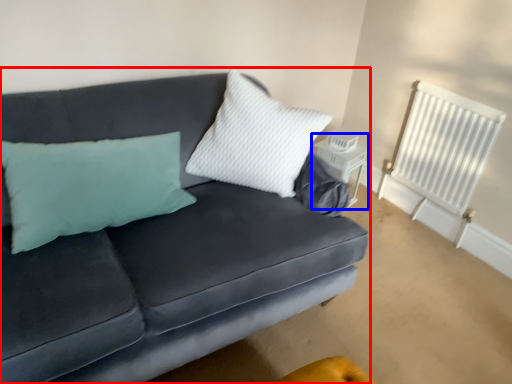
Question: Which object appears farthest to the camera in this image, studio couch (highlighted by a red box) or table (highlighted by a blue box)?

Choices:
 (A) studio couch
 (B) table

Answer: (B)